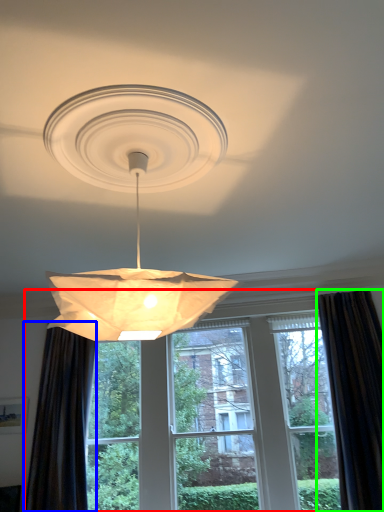
Question: Which object is positioned closest to window (highlighted by a red box)? Select from curtain (highlighted by a blue box) and curtain (highlighted by a green box).

Choices:
 (A) curtain
 (B) curtain

Answer: (A)